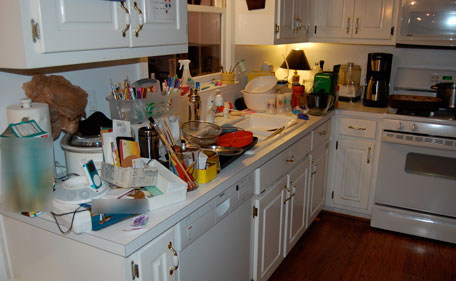
Image resolution: width=456 pixels, height=281 pixels. Identify the location of crock pot. (70, 159).